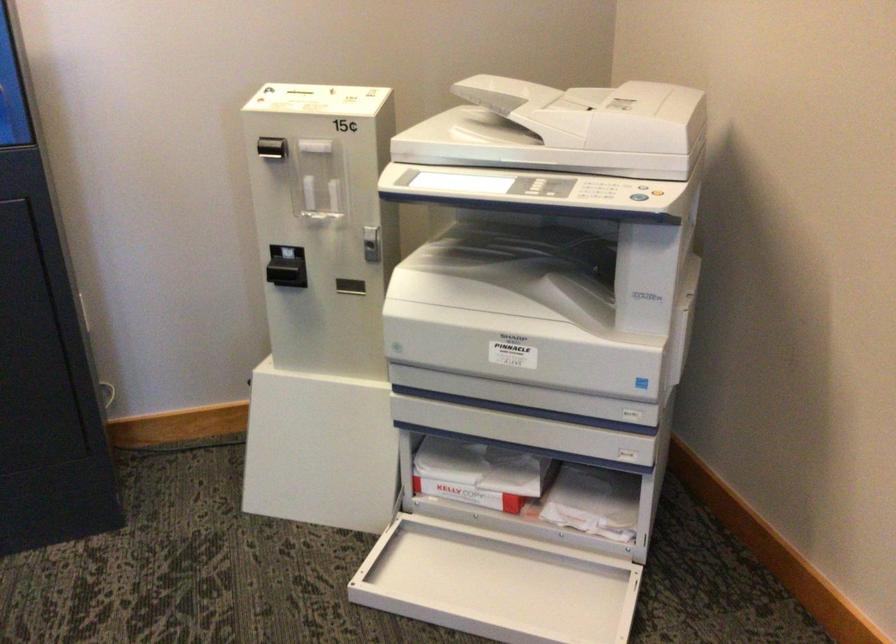
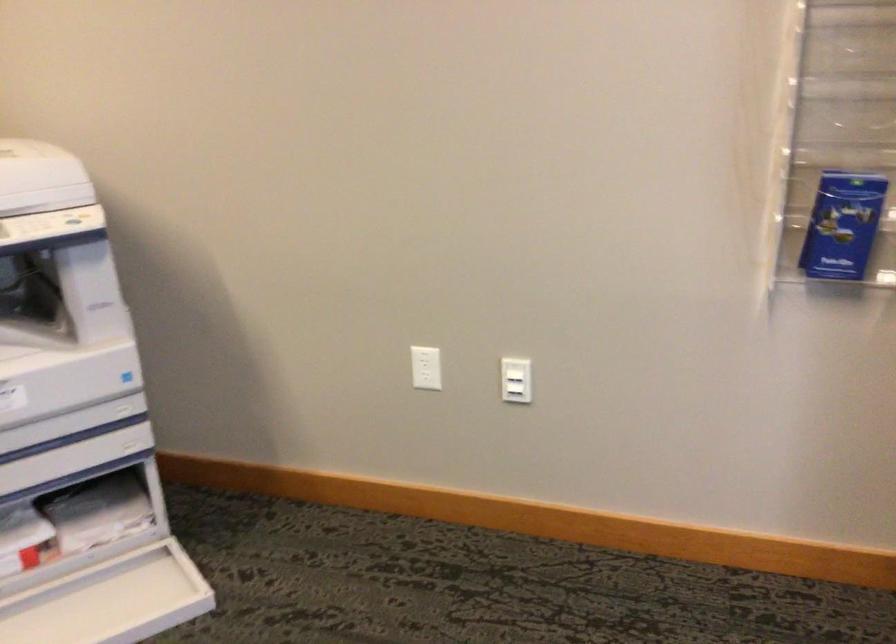
Question: The camera is either moving clockwise (left) or counter-clockwise (right) around the object. The first image is from the beginning of the video and the second image is from the end. Is the camera moving left or right when shooting the video?

Choices:
 (A) Left
 (B) Right

Answer: (A)